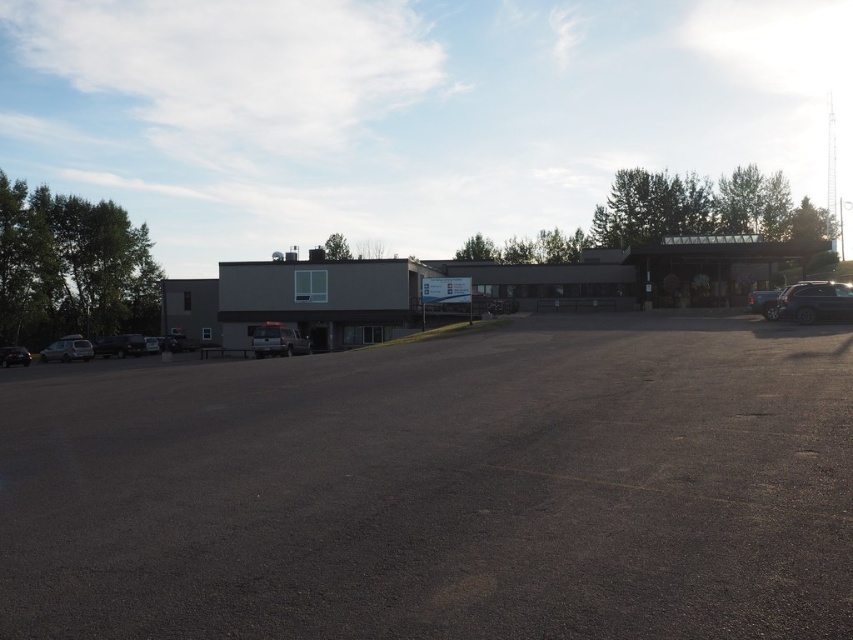
Question: Is metallic silver van at center thinner than matte silver suv at left?

Choices:
 (A) yes
 (B) no

Answer: (A)

Question: Which point is farther to the camera?

Choices:
 (A) dark asphalt parking lot at center
 (B) metallic silver van at center

Answer: (B)

Question: Can you confirm if satin black suv at right is wider than metallic silver sedan at lower left?

Choices:
 (A) yes
 (B) no

Answer: (B)

Question: Which of the following is the closest to the observer?

Choices:
 (A) shiny black sedan at lower left
 (B) metallic silver sedan at lower left

Answer: (A)

Question: Among these objects, which one is farthest from the camera?

Choices:
 (A) metallic silver sedan at lower left
 (B) matte silver suv at left

Answer: (B)

Question: Does satin black suv at right appear over shiny black sedan at lower left?

Choices:
 (A) no
 (B) yes

Answer: (B)